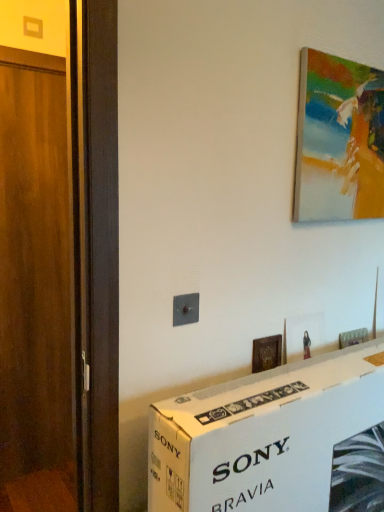
Locate an element on the screen. wooden door at left is located at coordinates (35, 293).

What do you see at coordinates (185, 309) in the screenshot? I see `metallic switch at center` at bounding box center [185, 309].

Based on the photo, how much space does painted canvas at upper right, the first picture frame when ordered from right to left, occupy vertically?

painted canvas at upper right, the first picture frame when ordered from right to left, is 22.08 inches tall.

Locate an element on the screen. The width and height of the screenshot is (384, 512). painted canvas at upper right, the first picture frame when ordered from right to left is located at coordinates (x=338, y=140).

Locate an element on the screen. wooden door at left is located at coordinates (35, 293).

From a real-world perspective, who is located higher, metallic switch at center or white cardboard box at lower center?

metallic switch at center, from a real-world perspective.

Is metallic switch at center closer to the viewer compared to white cardboard box at lower center?

No, metallic switch at center is further to the viewer.

Considering the relative sizes of metallic switch at center and white cardboard box at lower center in the image provided, is metallic switch at center shorter than white cardboard box at lower center?

Yes.

From the picture: Which object is wider, metallic switch at center or white cardboard box at lower center?

Wider between the two is white cardboard box at lower center.

In terms of width, does wooden door at left look wider or thinner when compared to metallic switch at center?

In the image, wooden door at left appears to be wider than metallic switch at center.

Is point (52, 105) positioned in front of point (178, 317)?

No, (52, 105) is further to viewer.

Is metallic switch at center inside wooden door at left?

Actually, metallic switch at center is outside wooden door at left.

From the picture: Measure the distance between wooden door at left and wooden picture frame at center, which ranks as the 2th picture frame in top-to-bottom order.

4.26 feet.

Looking at this image, could you tell me if wooden door at left is turned towards wooden picture frame at center, the 1th picture frame when ordered from left to right?

No, wooden door at left does not turn towards wooden picture frame at center, the 1th picture frame when ordered from left to right.

This screenshot has height=512, width=384. What are the coordinates of `door above the wooden picture frame at center, the 1th picture frame when ordered from left to right (from the image's perspective)` in the screenshot? It's located at (35, 293).

Is wooden picture frame at center, the second picture frame positioned from the right, completely or partially inside wooden door at left?

Definitely not — wooden picture frame at center, the second picture frame positioned from the right, is not inside wooden door at left.

Are painted canvas at upper right, the first picture frame when ordered from right to left, and white cardboard box at lower center making contact?

No, painted canvas at upper right, the first picture frame when ordered from right to left, is not in contact with white cardboard box at lower center.

Can we say painted canvas at upper right, the first picture frame when ordered from right to left, lies outside white cardboard box at lower center?

painted canvas at upper right, the first picture frame when ordered from right to left, lies outside white cardboard box at lower center's area.

Between painted canvas at upper right, which is counted as the second picture frame, starting from the left, and white cardboard box at lower center, which one is positioned behind?

painted canvas at upper right, which is counted as the second picture frame, starting from the left, is further away from the camera.

Between painted canvas at upper right, the first picture frame when ordered from top to bottom, and white cardboard box at lower center, which one has larger size?

With larger size is white cardboard box at lower center.

Is painted canvas at upper right, which is counted as the second picture frame, starting from the left, not near metallic switch at center?

painted canvas at upper right, which is counted as the second picture frame, starting from the left, is near metallic switch at center, not far away.

Between point (376, 152) and point (179, 309), which one is positioned behind?

Positioned behind is point (376, 152).

From the image's perspective, is painted canvas at upper right, the first picture frame when ordered from right to left, located above metallic switch at center?

Indeed, from the image's perspective, painted canvas at upper right, the first picture frame when ordered from right to left, is shown above metallic switch at center.

Can you confirm if painted canvas at upper right, the first picture frame when ordered from top to bottom, is shorter than metallic switch at center?

Incorrect, the height of painted canvas at upper right, the first picture frame when ordered from top to bottom, does not fall short of that of metallic switch at center.

Is white cardboard box at lower center surrounding wooden door at left?

Actually, wooden door at left is outside white cardboard box at lower center.

Is point (344, 435) behind point (61, 200)?

No, (344, 435) is closer to viewer.

How many degrees apart are the facing directions of white cardboard box at lower center and wooden door at left?

The facing directions of white cardboard box at lower center and wooden door at left are 0.45 degrees apart.

Can you confirm if white cardboard box at lower center is positioned to the right of wooden door at left?

Correct, you'll find white cardboard box at lower center to the right of wooden door at left.

What's the angular difference between wooden door at left and painted canvas at upper right, which is counted as the second picture frame, starting from the left,'s facing directions?

They differ by 0.3 degrees in their facing directions.

Considering the sizes of objects wooden door at left and painted canvas at upper right, the second picture frame when ordered from bottom to top, in the image provided, who is wider, wooden door at left or painted canvas at upper right, the second picture frame when ordered from bottom to top,?

Wider between the two is wooden door at left.

Is point (34, 260) less distant than point (378, 83)?

No.

In terms of height, does wooden door at left look taller or shorter compared to painted canvas at upper right, the second picture frame when ordered from bottom to top?

In the image, wooden door at left appears to be taller than painted canvas at upper right, the second picture frame when ordered from bottom to top.

I want to click on box on the right of the metallic switch at center, so click(275, 440).

Find the location of `door on the left of metallic switch at center`. door on the left of metallic switch at center is located at coordinates (35, 293).

Estimate the real-world distances between objects in this image. Which object is further from wooden door at left, painted canvas at upper right, the second picture frame when ordered from bottom to top, or wooden picture frame at center, which is the 1th picture frame in bottom-to-top order?

painted canvas at upper right, the second picture frame when ordered from bottom to top, is positioned further to the anchor wooden door at left.

Which object lies nearer to the anchor point white cardboard box at lower center, wooden door at left or painted canvas at upper right, which is counted as the second picture frame, starting from the left?

painted canvas at upper right, which is counted as the second picture frame, starting from the left.

Which object lies further to the anchor point white cardboard box at lower center, metallic switch at center or wooden door at left?

Among the two, wooden door at left is located further to white cardboard box at lower center.

When comparing their distances from white cardboard box at lower center, does metallic switch at center or wooden picture frame at center, the 1th picture frame when ordered from left to right, seem further?

Based on the image, metallic switch at center appears to be further to white cardboard box at lower center.

Based on the photo, estimate the real-world distances between objects in this image. Which object is closer to painted canvas at upper right, the first picture frame when ordered from top to bottom, wooden picture frame at center, which ranks as the 2th picture frame in top-to-bottom order, or wooden door at left?

A: wooden picture frame at center, which ranks as the 2th picture frame in top-to-bottom order, is closer to painted canvas at upper right, the first picture frame when ordered from top to bottom.

From the image, which object appears to be farther from painted canvas at upper right, the first picture frame when ordered from top to bottom, metallic switch at center or wooden picture frame at center, the second picture frame positioned from the right?

Among the two, metallic switch at center is located further to painted canvas at upper right, the first picture frame when ordered from top to bottom.

Based on the photo, from the image, which object appears to be farther from metallic switch at center, wooden picture frame at center, the second picture frame positioned from the right, or wooden door at left?

wooden door at left is further to metallic switch at center.

Estimate the real-world distances between objects in this image. Which object is closer to metallic switch at center, wooden door at left or wooden picture frame at center, which is the 1th picture frame in bottom-to-top order?

Based on the image, wooden picture frame at center, which is the 1th picture frame in bottom-to-top order, appears to be nearer to metallic switch at center.

Where is `electric outlet that lies between painted canvas at upper right, which is counted as the second picture frame, starting from the left, and white cardboard box at lower center from top to bottom`? This screenshot has width=384, height=512. electric outlet that lies between painted canvas at upper right, which is counted as the second picture frame, starting from the left, and white cardboard box at lower center from top to bottom is located at coordinates (185, 309).

Locate an element on the screen. This screenshot has height=512, width=384. electric outlet between wooden door at left and white cardboard box at lower center is located at coordinates (185, 309).

Where is `picture frame between painted canvas at upper right, the first picture frame when ordered from right to left, and white cardboard box at lower center in the up-down direction`? picture frame between painted canvas at upper right, the first picture frame when ordered from right to left, and white cardboard box at lower center in the up-down direction is located at coordinates (266, 353).

You are a GUI agent. You are given a task and a screenshot of the screen. Output one action in this format:
    pyautogui.click(x=<x>, y=<y>)
    Task: Click on the electric outlet between wooden door at left and wooden picture frame at center, the second picture frame positioned from the right, from left to right
    The height and width of the screenshot is (512, 384).
    Given the screenshot: What is the action you would take?
    pyautogui.click(x=185, y=309)